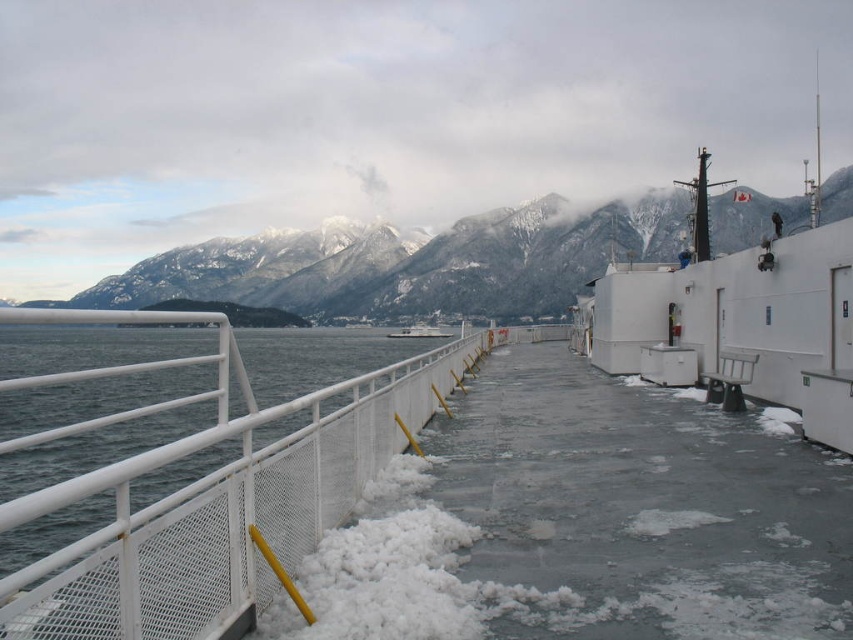
You are a passenger on the ferry and want to avoid slipping on the icy deck. The ferry deck has a slippery white ice at left located at point (219, 513). Where should you step to avoid slipping?

You should avoid stepping on the white ice at left located at point (219, 513) since it is slippery. Instead, choose areas without ice or with better traction.

In the scene shown: You are a passenger on the ferry and want to take a photo of both the snowy mountain at upper center and the white matte boat at center. Which object will appear larger in your photo?

The snowy mountain at upper center will appear larger in the photo because it is closer to the viewer than the white matte boat at center.

You are a passenger on the ferry and want to know the distance between the white ice at left and the snowy mountain at upper center. Can you tell me how far apart they are?

The white ice at left is 258.43 meters away from the snowy mountain at upper center.